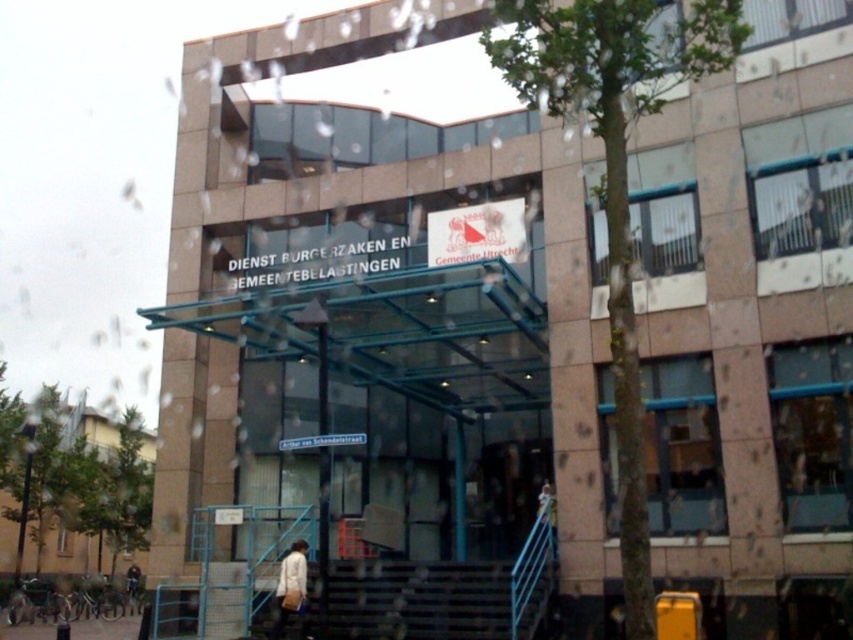
You are a visitor entering the building and need to reach the service counter located at the back. You see the metallic gray stairs at lower center and the white fabric bag at lower center. Which object should you move towards first to avoid obstacles?

You should move towards the white fabric bag at lower center first because the metallic gray stairs at lower center is to the right of it, so moving towards the bag would allow you to navigate around the stairs and reach the service counter without obstacles.

You are standing in front of the Civil Affairs and Municipal Taxation Service building in Utrecht. You have a white fabric bag at lower center. Where is the white fabric bag located in relation to the building?

The white fabric bag at lower center is located at point (291, 588) relative to the building.